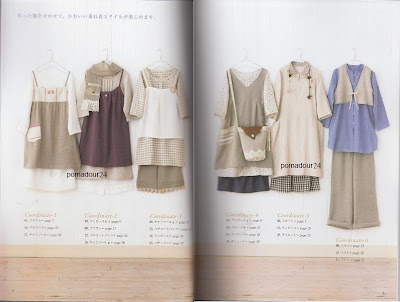
I want to click on light wooden table top, so click(x=125, y=286), click(x=280, y=284).